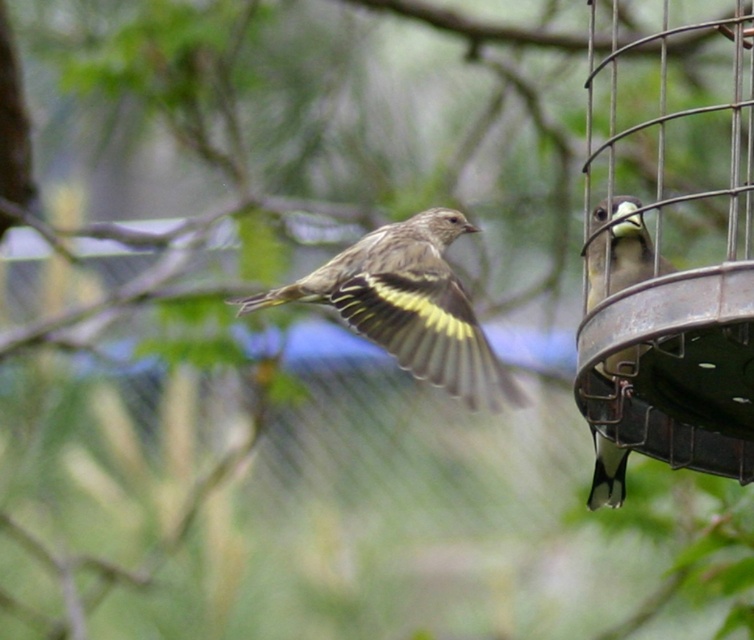
You are a birdwatcher observing the scene. You notice two objects of interest in the image. The metallic wire bird feeder at right and the brown speckled feathers at center. Which object is closer to you, the observer?

The metallic wire bird feeder at right is closer to you because the brown speckled feathers at center is behind it.